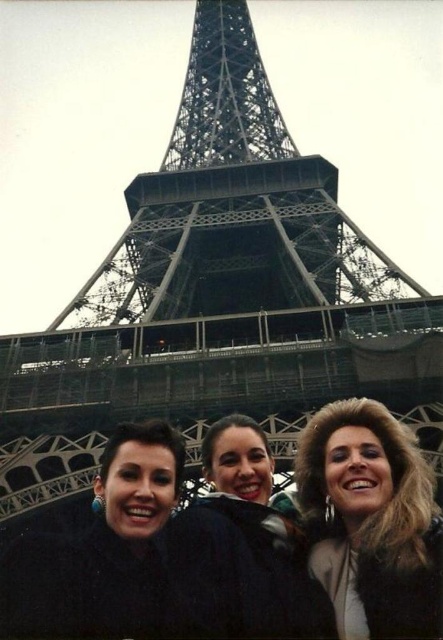
You are a photographer trying to adjust the focus on your camera to capture the three people in front of the Eiffel Tower. You notice the fuzzy brown hair at center and the matte black jacket at center. Which object should you focus on first to ensure both are in sharp focus?

The fuzzy brown hair at center is in front of the matte black jacket at center, so you should focus on the fuzzy brown hair at center first to ensure both are in sharp focus.

You are standing in front of the Eiffel Tower and see two points marked in the scene. The first point is at coordinate point (430, 515) and the second point is at coordinate point (194, 529). Which point is closer to you?

Point (430, 515) is closer to the viewer than point (194, 529).